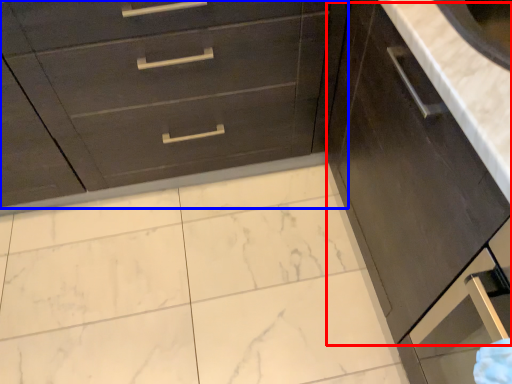
Question: Which point is closer to the camera, cabinetry (highlighted by a red box) or chest of drawers (highlighted by a blue box)?

Choices:
 (A) cabinetry
 (B) chest of drawers

Answer: (A)